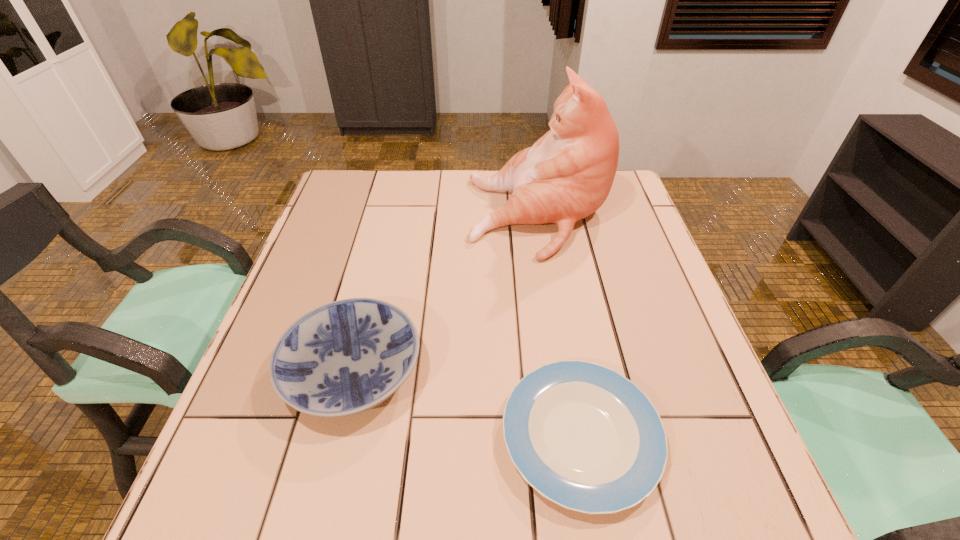
At what (x,y) coordinates should I click in order to perform the action: click on free spot that satisfies the following two spatial constraints: 1. on the face of the tallest object; 2. on the front side of the taller plate. Please return your answer as a coordinate pair (x, y). Image resolution: width=960 pixels, height=540 pixels. Looking at the image, I should click on (564, 370).

The height and width of the screenshot is (540, 960). I want to click on free location that satisfies the following two spatial constraints: 1. on the back side of the shortest object; 2. on the face of the cat, so click(x=542, y=217).

Where is `free space that satisfies the following two spatial constraints: 1. on the face of the shorter plate; 2. on the right side of the farthest object`? free space that satisfies the following two spatial constraints: 1. on the face of the shorter plate; 2. on the right side of the farthest object is located at coordinates (574, 436).

Identify the location of free spot that satisfies the following two spatial constraints: 1. on the front side of the right plate; 2. on the left side of the leftmost object. Image resolution: width=960 pixels, height=540 pixels. (337, 436).

In order to click on free space that satisfies the following two spatial constraints: 1. on the face of the cat; 2. on the back side of the right plate in this screenshot , I will do pos(574,436).

At what (x,y) coordinates should I click in order to perform the action: click on free space that satisfies the following two spatial constraints: 1. on the face of the shorter plate; 2. on the right side of the farthest object. Please return your answer as a coordinate pair (x, y). The height and width of the screenshot is (540, 960). Looking at the image, I should click on (574, 436).